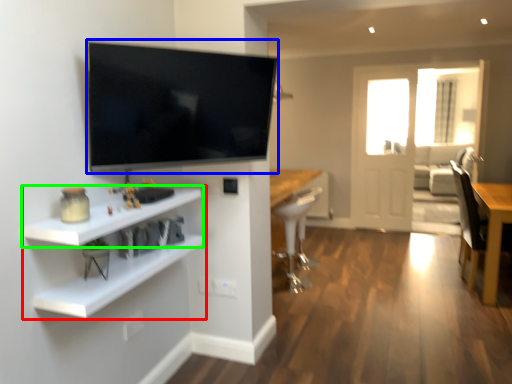
Question: Considering the real-world distances, which object is farthest from shelf (highlighted by a red box)? television (highlighted by a blue box) or shelf (highlighted by a green box)?

Choices:
 (A) television
 (B) shelf

Answer: (A)